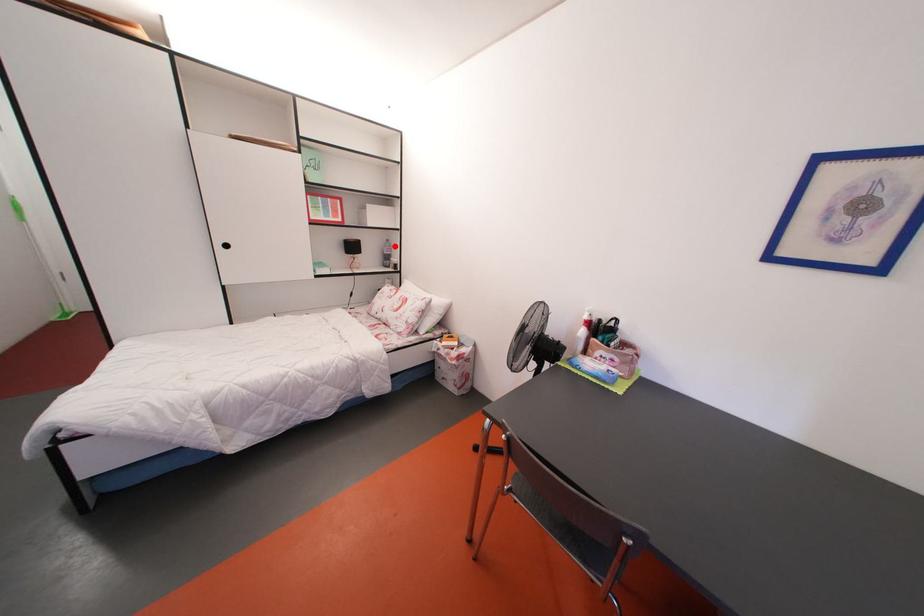
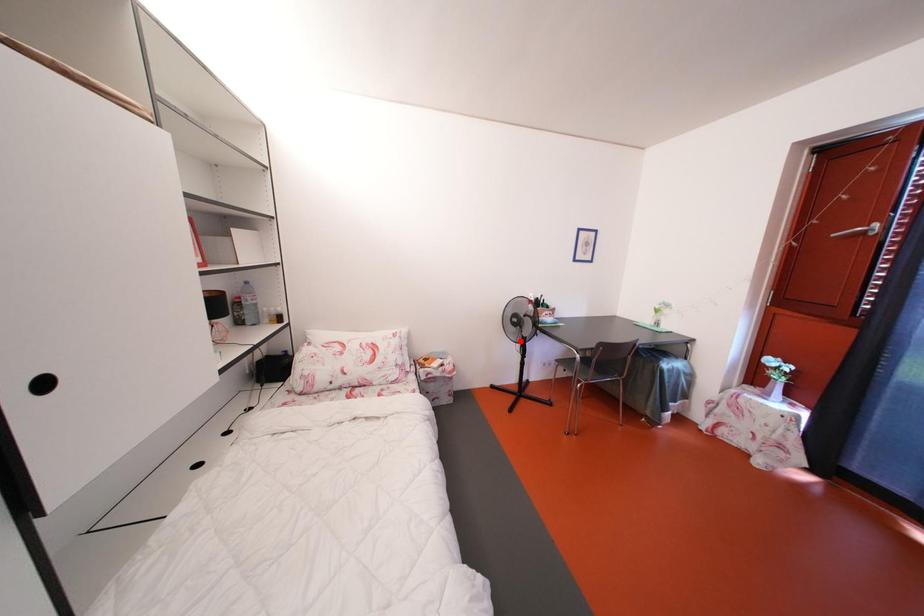
I am providing you with two images of the same scene from different viewpoints. A red point is marked on the first image and another point is marked on the second image. Do the highlighted points in image1 and image2 indicate the same real-world spot?

No